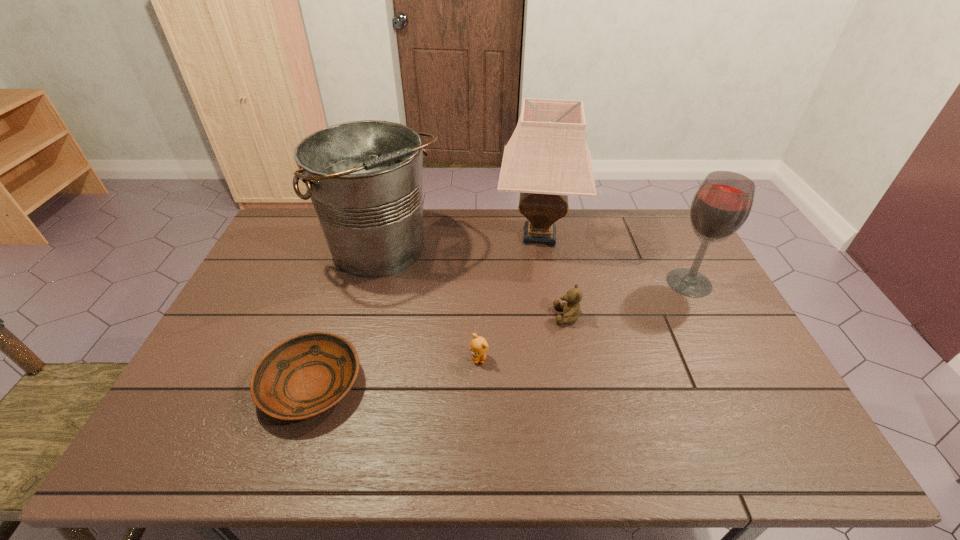
Image resolution: width=960 pixels, height=540 pixels. Find the location of `free space located on the front of the alcohol`. free space located on the front of the alcohol is located at coordinates (707, 316).

You are a GUI agent. You are given a task and a screenshot of the screen. Output one action in this format:
    pyautogui.click(x=<x>, y=<y>)
    Task: Click on the vacant space located 0.120m on the front-facing side of the right teddy bear
    Image resolution: width=960 pixels, height=540 pixels.
    Given the screenshot: What is the action you would take?
    pyautogui.click(x=513, y=316)

Find the location of `vacant space located on the front-facing side of the right teddy bear`. vacant space located on the front-facing side of the right teddy bear is located at coordinates (424, 316).

This screenshot has width=960, height=540. In order to click on free space located on the front-facing side of the right teddy bear in this screenshot , I will do `click(451, 316)`.

Locate an element on the screen. This screenshot has width=960, height=540. vacant space located 0.210m on the face of the nearer teddy bear is located at coordinates (479, 441).

You are a GUI agent. You are given a task and a screenshot of the screen. Output one action in this format:
    pyautogui.click(x=<x>, y=<y>)
    Task: Click on the vacant region located on the back of the shortest object
    
    Given the screenshot: What is the action you would take?
    pyautogui.click(x=340, y=299)

Locate an element on the screen. This screenshot has height=540, width=960. lampshade located at the far edge is located at coordinates (547, 158).

Locate an element on the screen. bucket situated at the far edge is located at coordinates (364, 178).

Find the location of `object located in the near edge section of the desktop`. object located in the near edge section of the desktop is located at coordinates (304, 376).

What are the coordinates of `object present at the right edge` in the screenshot? It's located at (721, 205).